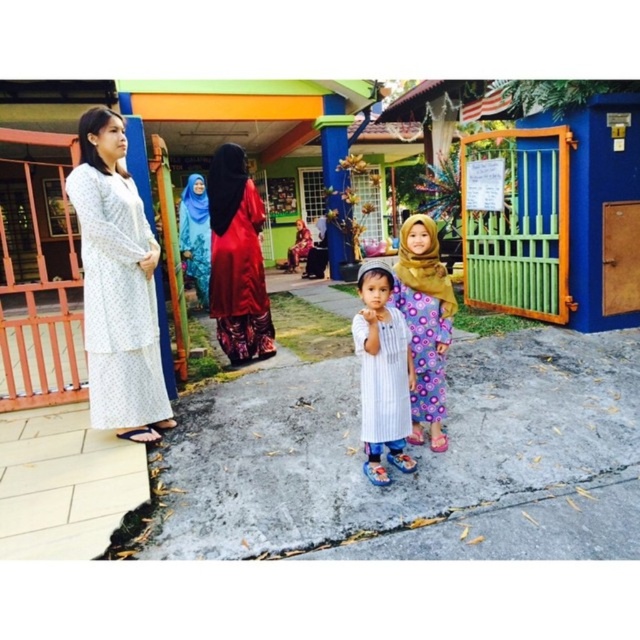
You are a photographer setting up for an event at the community center. You want to ensure that the gray concrete pavement at center and the striped fabric dress at center are both in focus. Given that your camera can only focus on objects within 30 inches of each other, will both subjects be in focus?

The gray concrete pavement at center is 33.85 inches from striped fabric dress at center, which exceeds the 30 inch focus range. Therefore, both subjects cannot be in focus simultaneously.

You are a photographer standing 1.5 meters away from the camera. You want to take a photo of the white printed dress at left. Can you reach the camera to adjust it?

The distance between you and the camera is 1.5 meters, and the camera and the white printed dress at left are 2.71 meters apart. Therefore, you are 1.5 meters away from the camera, which is within reach to adjust it for taking a photo of the white printed dress at left.

You are a photographer trying to capture a clear shot of both the white striped shirt at center and the blue fabric hijab at center. Since you want both subjects in focus, which one should you adjust your camera to prioritize focusing on first?

You should prioritize focusing on the white striped shirt at center first because it is closer to the viewer than the blue fabric hijab at center, ensuring both will be in focus when using depth of field techniques.